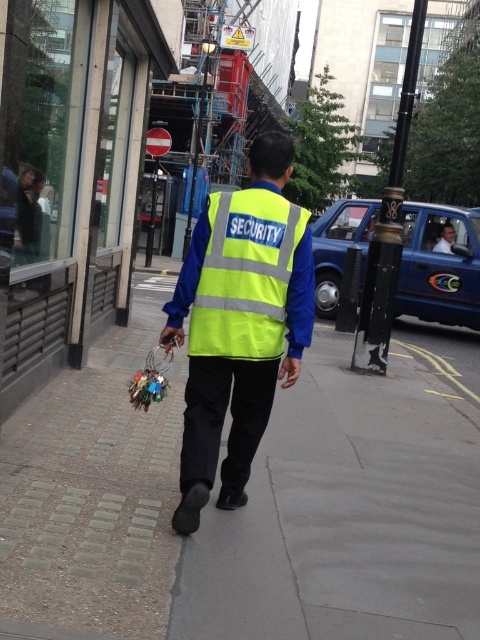
You are a delivery person trying to find the entrance to the building. You see the brick paved sidewalk at center and the yellow reflective vest at center. Which object is closer to the entrance of the building?

The brick paved sidewalk at center is located below the yellow reflective vest at center, meaning the sidewalk is closer to the entrance than the vest.

You are a delivery person with a cart that is 2 meters wide. You need to move from the camera to the brick paved sidewalk at center. Is there enough space for your cart to pass through?

The distance between the camera and the brick paved sidewalk at center is 2.20 meters. Since the cart is 2 meters wide, there is enough space for the cart to pass through.